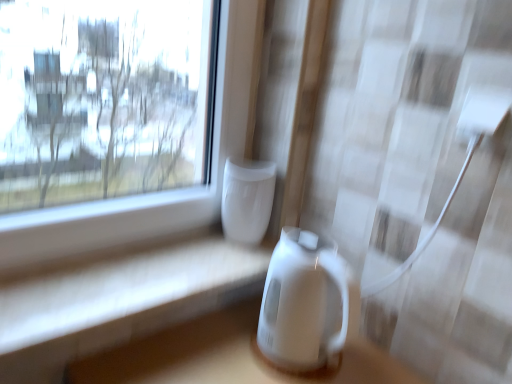
This screenshot has width=512, height=384. What do you see at coordinates (247, 199) in the screenshot? I see `white glossy vase at center, which is the second appliance from bottom to top` at bounding box center [247, 199].

The width and height of the screenshot is (512, 384). Find the location of `white glossy vase at center, placed as the 1th appliance when sorted from top to bottom`. white glossy vase at center, placed as the 1th appliance when sorted from top to bottom is located at coordinates 247,199.

Is white glossy vase at center, which is the second appliance from bottom to top, oriented away from white glossy electric kettle at center, the second appliance positioned from the top?

No, white glossy vase at center, which is the second appliance from bottom to top, is not facing the opposite direction of white glossy electric kettle at center, the second appliance positioned from the top.

Considering the sizes of objects white glossy vase at center, placed as the 1th appliance when sorted from top to bottom, and white glossy electric kettle at center, the second appliance positioned from the top, in the image provided, who is bigger, white glossy vase at center, placed as the 1th appliance when sorted from top to bottom, or white glossy electric kettle at center, the second appliance positioned from the top,?

With larger size is white glossy electric kettle at center, the second appliance positioned from the top.

Can you see white glossy vase at center, which is the second appliance from bottom to top, touching white glossy electric kettle at center, the second appliance positioned from the top?

No, white glossy vase at center, which is the second appliance from bottom to top, is not in contact with white glossy electric kettle at center, the second appliance positioned from the top.

Does white glossy vase at center, which is the second appliance from bottom to top, appear on the left side of white glossy electric kettle at center, positioned as the 1th appliance in bottom-to-top order?

Yes.

How much distance is there between white glossy vase at center, which is the second appliance from bottom to top, and white glossy table at lower center?

They are 9.80 inches apart.

Which object is more forward, white glossy vase at center, placed as the 1th appliance when sorted from top to bottom, or white glossy table at lower center?

Positioned in front is white glossy table at lower center.

Is white glossy vase at center, which is the second appliance from bottom to top, to the left of white glossy table at lower center from the viewer's perspective?

In fact, white glossy vase at center, which is the second appliance from bottom to top, is to the right of white glossy table at lower center.

From the picture: Are white glossy vase at center, placed as the 1th appliance when sorted from top to bottom, and white glossy table at lower center located far from each other?

That's not correct — white glossy vase at center, placed as the 1th appliance when sorted from top to bottom, is a little close to white glossy table at lower center.

Where is `appliance on the left of the white glossy electric kettle at center, the second appliance positioned from the top`? The height and width of the screenshot is (384, 512). appliance on the left of the white glossy electric kettle at center, the second appliance positioned from the top is located at coordinates (247, 199).

Which of these two, white glossy electric kettle at center, the second appliance positioned from the top, or white glossy vase at center, which is the second appliance from bottom to top, stands shorter?

white glossy vase at center, which is the second appliance from bottom to top, is shorter.

Can white glossy vase at center, placed as the 1th appliance when sorted from top to bottom, be found inside white glossy electric kettle at center, the second appliance positioned from the top?

Actually, white glossy vase at center, placed as the 1th appliance when sorted from top to bottom, is outside white glossy electric kettle at center, the second appliance positioned from the top.

Considering their positions, is white glossy electric kettle at center, positioned as the 1th appliance in bottom-to-top order, located in front of or behind white glossy vase at center, which is the second appliance from bottom to top?

In the image, white glossy electric kettle at center, positioned as the 1th appliance in bottom-to-top order, appears in front of white glossy vase at center, which is the second appliance from bottom to top.

Is white glossy table at lower center oriented away from white glossy vase at center, which is the second appliance from bottom to top?

That's not correct — white glossy table at lower center is not looking away from white glossy vase at center, which is the second appliance from bottom to top.

From the image's perspective, is white glossy table at lower center positioned above or below white glossy vase at center, placed as the 1th appliance when sorted from top to bottom?

white glossy table at lower center is situated lower than white glossy vase at center, placed as the 1th appliance when sorted from top to bottom, in the image.

Is white glossy table at lower center not near white glossy vase at center, which is the second appliance from bottom to top?

No, white glossy table at lower center is not far from white glossy vase at center, which is the second appliance from bottom to top.

Is white glossy table at lower center further to the viewer compared to white glossy vase at center, placed as the 1th appliance when sorted from top to bottom?

No, white glossy table at lower center is closer to the viewer.

Is white glossy electric kettle at center, the second appliance positioned from the top, further to the viewer compared to white glossy table at lower center?

Yes.

Is white glossy electric kettle at center, the second appliance positioned from the top, facing away from white glossy table at lower center?

No.

Is white glossy electric kettle at center, positioned as the 1th appliance in bottom-to-top order, bigger or smaller than white glossy table at lower center?

Clearly, white glossy electric kettle at center, positioned as the 1th appliance in bottom-to-top order, is larger in size than white glossy table at lower center.

At what (x,y) coordinates should I click in order to perform the action: click on table located underneath the white glossy electric kettle at center, the second appliance positioned from the top (from a real-world perspective). Please return your answer as a coordinate pair (x, y). Looking at the image, I should click on (118, 302).

Is white glossy table at lower center next to white glossy electric kettle at center, positioned as the 1th appliance in bottom-to-top order?

white glossy table at lower center is not next to white glossy electric kettle at center, positioned as the 1th appliance in bottom-to-top order, and they're not touching.

Which of these two, white glossy table at lower center or white glossy electric kettle at center, positioned as the 1th appliance in bottom-to-top order, is wider?

Wider between the two is white glossy table at lower center.

Is white glossy table at lower center spatially inside white glossy electric kettle at center, positioned as the 1th appliance in bottom-to-top order, or outside of it?

white glossy table at lower center is outside white glossy electric kettle at center, positioned as the 1th appliance in bottom-to-top order.

This screenshot has height=384, width=512. Identify the location of appliance that appears below the white glossy vase at center, which is the second appliance from bottom to top (from the image's perspective). [x=303, y=302].

This screenshot has height=384, width=512. I want to click on appliance lying above the white glossy table at lower center (from the image's perspective), so click(247, 199).

Based on their spatial positions, is white glossy table at lower center or white glossy vase at center, which is the second appliance from bottom to top, further from white glossy electric kettle at center, positioned as the 1th appliance in bottom-to-top order?

Based on the image, white glossy table at lower center appears to be further to white glossy electric kettle at center, positioned as the 1th appliance in bottom-to-top order.

Looking at the image, which one is located further to white glossy vase at center, placed as the 1th appliance when sorted from top to bottom, white glossy electric kettle at center, the second appliance positioned from the top, or white glossy table at lower center?

white glossy table at lower center.

Based on their spatial positions, is white glossy vase at center, placed as the 1th appliance when sorted from top to bottom, or white glossy table at lower center further from white glossy electric kettle at center, positioned as the 1th appliance in bottom-to-top order?

Based on the image, white glossy table at lower center appears to be further to white glossy electric kettle at center, positioned as the 1th appliance in bottom-to-top order.

Consider the image. Which object lies nearer to the anchor point white glossy vase at center, placed as the 1th appliance when sorted from top to bottom, white glossy table at lower center or white glossy electric kettle at center, the second appliance positioned from the top?

white glossy electric kettle at center, the second appliance positioned from the top.

Which object lies nearer to the anchor point white glossy table at lower center, white glossy electric kettle at center, positioned as the 1th appliance in bottom-to-top order, or white glossy vase at center, which is the second appliance from bottom to top?

white glossy electric kettle at center, positioned as the 1th appliance in bottom-to-top order, is closer to white glossy table at lower center.

From the image, which object appears to be nearer to white glossy table at lower center, white glossy vase at center, placed as the 1th appliance when sorted from top to bottom, or white glossy electric kettle at center, the second appliance positioned from the top?

Based on the image, white glossy electric kettle at center, the second appliance positioned from the top, appears to be nearer to white glossy table at lower center.

Locate an element on the screen. This screenshot has width=512, height=384. appliance between white glossy table at lower center and white glossy electric kettle at center, the second appliance positioned from the top, in the horizontal direction is located at coordinates (247, 199).